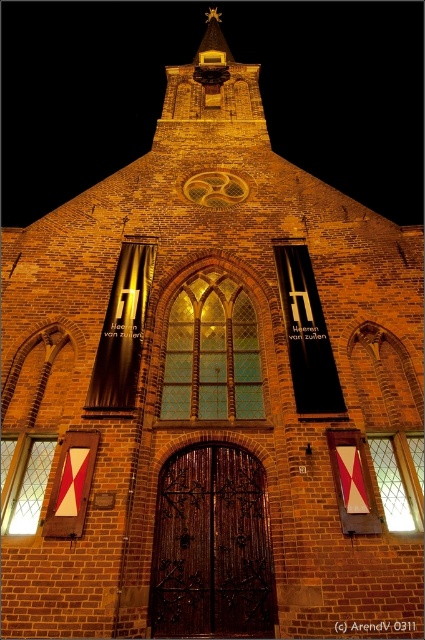
Find the location of a particular element. dark brown wood at center is located at coordinates (212, 547).

Can you confirm if dark brown wood at center is bigger than transparent glass window at lower left?

Yes, dark brown wood at center is bigger than transparent glass window at lower left.

Is point (254, 561) more distant than point (36, 468)?

No, it is in front of (36, 468).

Locate an element on the screen. The width and height of the screenshot is (425, 640). dark brown wood at center is located at coordinates (212, 547).

Does dark brown wood at center have a greater width compared to translucent glass window at center?

No.

Between dark brown wood at center and translucent glass window at center, which one has less height?

dark brown wood at center is shorter.

What do you see at coordinates (212, 547) in the screenshot? The width and height of the screenshot is (425, 640). I see `dark brown wood at center` at bounding box center [212, 547].

Find the location of a particular element. The width and height of the screenshot is (425, 640). dark brown wood at center is located at coordinates click(212, 547).

Can you confirm if translucent glass window at center is smaller than transparent glass window at lower left?

No, translucent glass window at center is not smaller than transparent glass window at lower left.

Is point (195, 324) farther from camera compared to point (25, 490)?

That is True.

Between point (170, 401) and point (34, 440), which one is positioned behind?

The point (170, 401) is more distant.

What are the coordinates of `translucent glass window at center` in the screenshot? It's located at [x=212, y=353].